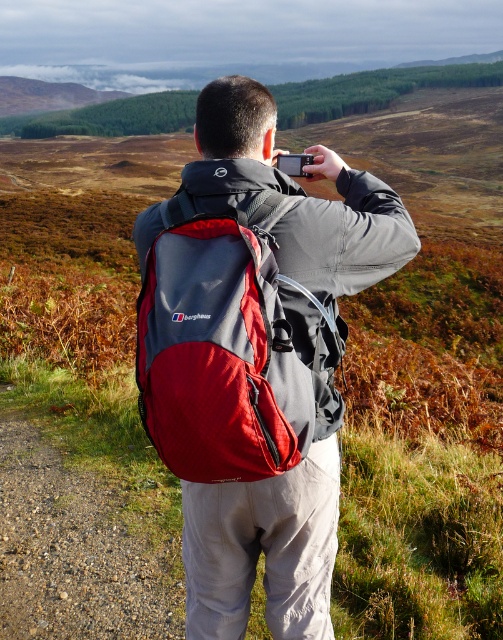
How much distance is there between red fabric backpack at back and black plastic camera at upper center?

They are 71.16 centimeters apart.

Is red fabric backpack at back bigger than black plastic camera at upper center?

Yes.

Which is in front, point (181, 252) or point (288, 160)?

Positioned in front is point (181, 252).

The width and height of the screenshot is (503, 640). What are the coordinates of `red fabric backpack at back` in the screenshot? It's located at (219, 348).

Is matte gray backpack at center positioned in front of black plastic camera at upper center?

Yes.

Which is in front, point (218, 259) or point (299, 156)?

Point (218, 259) is more forward.

Where is `matte gray backpack at center`? matte gray backpack at center is located at coordinates (255, 356).

What do you see at coordinates (255, 356) in the screenshot? The width and height of the screenshot is (503, 640). I see `matte gray backpack at center` at bounding box center [255, 356].

Where is `matte gray backpack at center`? The image size is (503, 640). matte gray backpack at center is located at coordinates (255, 356).